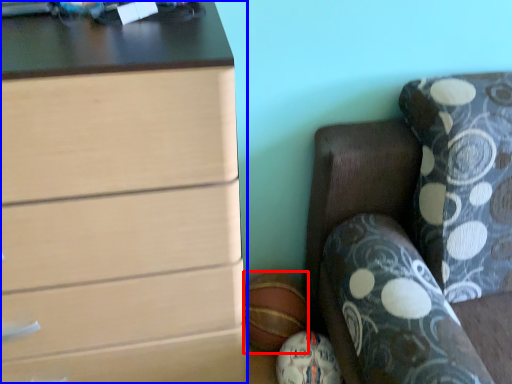
Question: Among these objects, which one is nearest to the camera, sports equipment (highlighted by a red box) or chest of drawers (highlighted by a blue box)?

Choices:
 (A) sports equipment
 (B) chest of drawers

Answer: (B)